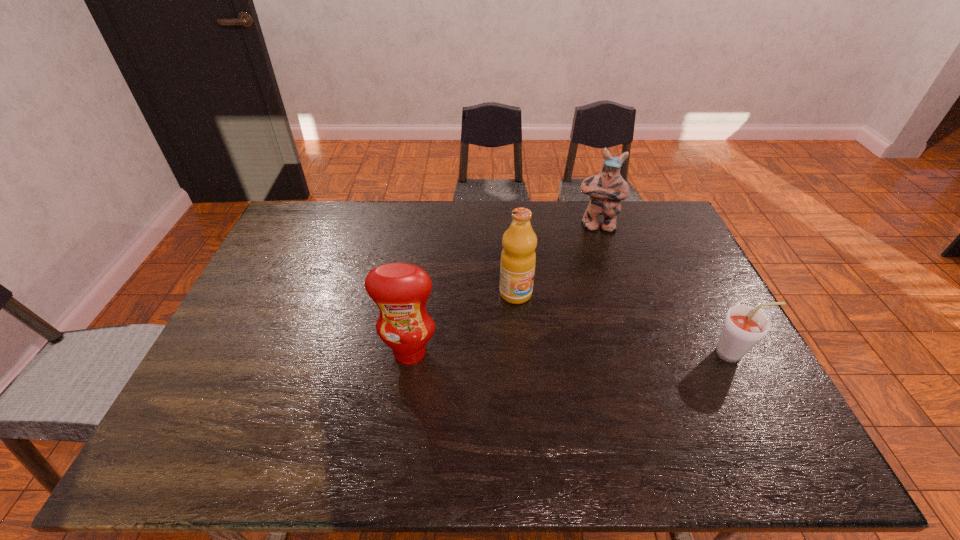
At what (x,y) coordinates should I click in order to perform the action: click on free space at the far left corner of the desktop. Please return your answer as a coordinate pair (x, y). Image resolution: width=960 pixels, height=540 pixels. Looking at the image, I should click on (329, 217).

You are a GUI agent. You are given a task and a screenshot of the screen. Output one action in this format:
    pyautogui.click(x=<x>, y=<y>)
    Task: Click on the vacant region at the far right corner of the desktop
    
    Given the screenshot: What is the action you would take?
    pyautogui.click(x=649, y=221)

At what (x,y) coordinates should I click in order to perform the action: click on free space at the near right corner of the desktop. Please return your answer as a coordinate pair (x, y). Looking at the image, I should click on (752, 396).

Locate an element on the screen. The image size is (960, 540). empty space between the root beer and the figurine is located at coordinates (665, 290).

Image resolution: width=960 pixels, height=540 pixels. I want to click on free space between the second object from right to left and the fruit juice, so click(x=556, y=260).

Identify the location of blank region between the leftmost object and the rightmost object. click(x=572, y=353).

Where is `empty location between the rightmost object and the third object from right to left`? empty location between the rightmost object and the third object from right to left is located at coordinates (625, 323).

Locate an element on the screen. The height and width of the screenshot is (540, 960). empty space that is in between the condiment and the rightmost object is located at coordinates (572, 353).

Locate an element on the screen. The width and height of the screenshot is (960, 540). free spot between the root beer and the second farthest object is located at coordinates (x=625, y=323).

The height and width of the screenshot is (540, 960). Find the location of `unoccupied position between the second object from right to left and the fruit juice`. unoccupied position between the second object from right to left and the fruit juice is located at coordinates (556, 260).